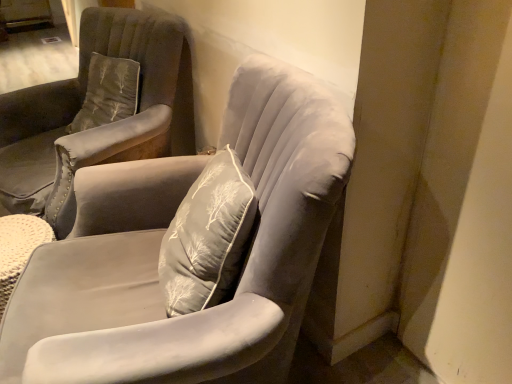
Where is `suede gray armchair at center, the second chair from the front`? Image resolution: width=512 pixels, height=384 pixels. suede gray armchair at center, the second chair from the front is located at coordinates (97, 111).

This screenshot has width=512, height=384. What do you see at coordinates (97, 111) in the screenshot?
I see `suede gray armchair at center, marked as the 1th chair in a back-to-front arrangement` at bounding box center [97, 111].

This screenshot has height=384, width=512. What are the coordinates of `velvet gray chair at center, acting as the 2th chair starting from the back` in the screenshot? It's located at (159, 246).

In order to face velvet gray chair at center, acting as the 2th chair starting from the back, should I rotate leftwards or rightwards?

You should rotate left by 12.779 degrees.

What do you see at coordinates (159, 246) in the screenshot?
I see `velvet gray chair at center, the first chair in the front-to-back sequence` at bounding box center [159, 246].

You are a GUI agent. You are given a task and a screenshot of the screen. Output one action in this format:
    pyautogui.click(x=<x>, y=<y>)
    Task: Click on the suede gray armchair at center, marked as the 1th chair in a back-to-front arrangement
    The height and width of the screenshot is (384, 512).
    Given the screenshot: What is the action you would take?
    pyautogui.click(x=97, y=111)

Considering the relative positions of velvet gray chair at center, acting as the 2th chair starting from the back, and suede gray armchair at center, marked as the 1th chair in a back-to-front arrangement, in the image provided, is velvet gray chair at center, acting as the 2th chair starting from the back, to the right of suede gray armchair at center, marked as the 1th chair in a back-to-front arrangement, from the viewer's perspective?

Yes.

Considering their positions, is velvet gray chair at center, acting as the 2th chair starting from the back, located in front of or behind suede gray armchair at center, marked as the 1th chair in a back-to-front arrangement?

velvet gray chair at center, acting as the 2th chair starting from the back, is positioned closer to the viewer than suede gray armchair at center, marked as the 1th chair in a back-to-front arrangement.

Considering the positions of point (243, 87) and point (179, 101), is point (243, 87) closer or farther from the camera than point (179, 101)?

Point (243, 87) appears to be closer to the viewer than point (179, 101).

From the image's perspective, is velvet gray chair at center, acting as the 2th chair starting from the back, located beneath suede gray armchair at center, the second chair from the front?

Indeed, from the image's perspective, velvet gray chair at center, acting as the 2th chair starting from the back, is shown beneath suede gray armchair at center, the second chair from the front.

From a real-world perspective, is velvet gray chair at center, the first chair in the front-to-back sequence, on top of suede gray armchair at center, marked as the 1th chair in a back-to-front arrangement?

No, from a real-world perspective, velvet gray chair at center, the first chair in the front-to-back sequence, is not over suede gray armchair at center, marked as the 1th chair in a back-to-front arrangement

Does velvet gray chair at center, the first chair in the front-to-back sequence, have a lesser width compared to suede gray armchair at center, marked as the 1th chair in a back-to-front arrangement?

Yes.

Considering the sizes of objects velvet gray chair at center, the first chair in the front-to-back sequence, and suede gray armchair at center, the second chair from the front, in the image provided, who is taller, velvet gray chair at center, the first chair in the front-to-back sequence, or suede gray armchair at center, the second chair from the front,?

Standing taller between the two is velvet gray chair at center, the first chair in the front-to-back sequence.

In terms of size, does velvet gray chair at center, the first chair in the front-to-back sequence, appear bigger or smaller than suede gray armchair at center, marked as the 1th chair in a back-to-front arrangement?

Considering their sizes, velvet gray chair at center, the first chair in the front-to-back sequence, takes up less space than suede gray armchair at center, marked as the 1th chair in a back-to-front arrangement.

Is velvet gray chair at center, acting as the 2th chair starting from the back, not inside suede gray armchair at center, the second chair from the front?

That's correct, velvet gray chair at center, acting as the 2th chair starting from the back, is outside of suede gray armchair at center, the second chair from the front.

Is velvet gray chair at center, acting as the 2th chair starting from the back, not close to suede gray armchair at center, marked as the 1th chair in a back-to-front arrangement?

Actually, velvet gray chair at center, acting as the 2th chair starting from the back, and suede gray armchair at center, marked as the 1th chair in a back-to-front arrangement, are a little close together.

Is suede gray armchair at center, the second chair from the front, at the back of velvet gray chair at center, the first chair in the front-to-back sequence?

velvet gray chair at center, the first chair in the front-to-back sequence, is not turned away from suede gray armchair at center, the second chair from the front.

Can you tell me how much velvet gray chair at center, acting as the 2th chair starting from the back, and suede gray armchair at center, marked as the 1th chair in a back-to-front arrangement, differ in facing direction?

The angular difference between velvet gray chair at center, acting as the 2th chair starting from the back, and suede gray armchair at center, marked as the 1th chair in a back-to-front arrangement, is 38.6 degrees.

Locate an element on the screen. chair located in front of the suede gray armchair at center, marked as the 1th chair in a back-to-front arrangement is located at coordinates (159, 246).

Is suede gray armchair at center, the second chair from the front, to the left or to the right of velvet gray chair at center, acting as the 2th chair starting from the back, in the image?

suede gray armchair at center, the second chair from the front, is positioned on velvet gray chair at center, acting as the 2th chair starting from the back,'s left side.

Consider the image. Is suede gray armchair at center, the second chair from the front, further to camera compared to velvet gray chair at center, the first chair in the front-to-back sequence?

Yes, suede gray armchair at center, the second chair from the front, is further from the camera.

Does point (18, 206) appear closer or farther from the camera than point (33, 373)?

Point (18, 206) is positioned farther from the camera compared to point (33, 373).

From the image's perspective, would you say suede gray armchair at center, the second chair from the front, is positioned over velvet gray chair at center, acting as the 2th chair starting from the back?

Indeed, from the image's perspective, suede gray armchair at center, the second chair from the front, is shown above velvet gray chair at center, acting as the 2th chair starting from the back.

From a real-world perspective, is suede gray armchair at center, marked as the 1th chair in a back-to-front arrangement, physically above velvet gray chair at center, acting as the 2th chair starting from the back?

Yes, from a real-world perspective, suede gray armchair at center, marked as the 1th chair in a back-to-front arrangement, is on top of velvet gray chair at center, acting as the 2th chair starting from the back.

Looking at this image, which object is wider, suede gray armchair at center, the second chair from the front, or velvet gray chair at center, the first chair in the front-to-back sequence?

suede gray armchair at center, the second chair from the front.

Considering the relative sizes of suede gray armchair at center, the second chair from the front, and velvet gray chair at center, acting as the 2th chair starting from the back, in the image provided, is suede gray armchair at center, the second chair from the front, taller than velvet gray chair at center, acting as the 2th chair starting from the back,?

No, suede gray armchair at center, the second chair from the front, is not taller than velvet gray chair at center, acting as the 2th chair starting from the back.

In terms of size, does suede gray armchair at center, marked as the 1th chair in a back-to-front arrangement, appear bigger or smaller than velvet gray chair at center, acting as the 2th chair starting from the back?

suede gray armchair at center, marked as the 1th chair in a back-to-front arrangement, is bigger than velvet gray chair at center, acting as the 2th chair starting from the back.

Do you think suede gray armchair at center, marked as the 1th chair in a back-to-front arrangement, is within velvet gray chair at center, acting as the 2th chair starting from the back, or outside of it?

suede gray armchair at center, marked as the 1th chair in a back-to-front arrangement, is not inside velvet gray chair at center, acting as the 2th chair starting from the back, it's outside.

Is suede gray armchair at center, the second chair from the front, next to velvet gray chair at center, the first chair in the front-to-back sequence?

No, suede gray armchair at center, the second chair from the front, is not touching velvet gray chair at center, the first chair in the front-to-back sequence.

Is velvet gray chair at center, acting as the 2th chair starting from the back, at the back of suede gray armchair at center, marked as the 1th chair in a back-to-front arrangement?

That's not correct — suede gray armchair at center, marked as the 1th chair in a back-to-front arrangement, is not looking away from velvet gray chair at center, acting as the 2th chair starting from the back.

In order to click on chair above the velvet gray chair at center, acting as the 2th chair starting from the back (from a real-world perspective) in this screenshot , I will do `click(97, 111)`.

Find the location of a particular element. chair above the velvet gray chair at center, acting as the 2th chair starting from the back (from a real-world perspective) is located at coordinates (97, 111).

Locate an element on the screen. The width and height of the screenshot is (512, 384). chair that appears behind the velvet gray chair at center, the first chair in the front-to-back sequence is located at coordinates (97, 111).